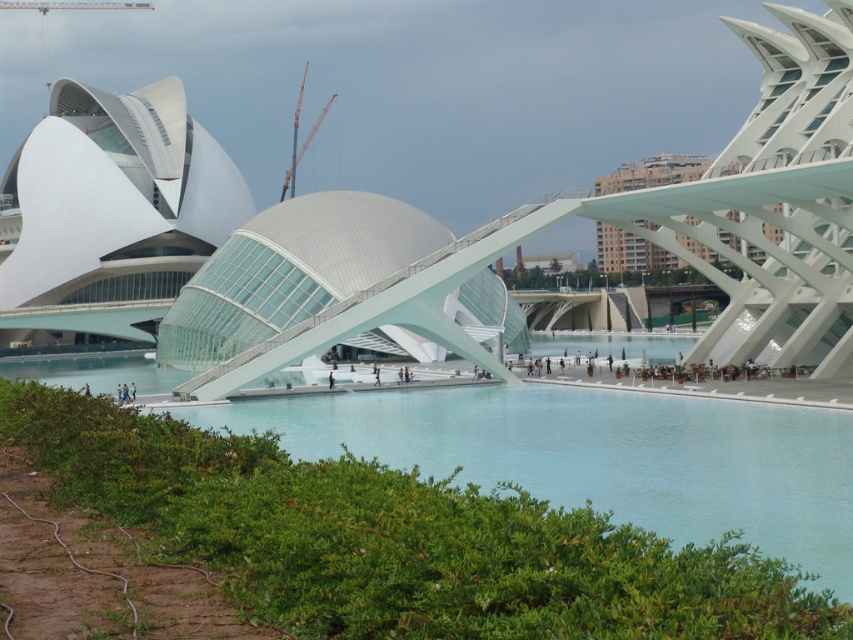
Is clear blue water at center thinner than orange metallic crane at center?

No.

Between clear blue water at center and orange metallic crane at center, which one appears on the left side from the viewer's perspective?

orange metallic crane at center is more to the left.

Does point (552, 394) come closer to viewer compared to point (302, 90)?

Yes, point (552, 394) is in front of point (302, 90).

I want to click on clear blue water at center, so (561, 448).

Does clear blue water at center have a greater width compared to white glass dome at center?

In fact, clear blue water at center might be narrower than white glass dome at center.

Is clear blue water at center smaller than white glass dome at center?

Yes.

Is point (762, 493) positioned before point (811, 296)?

Yes, it is in front of point (811, 296).

At what (x,y) coordinates should I click in order to perform the action: click on clear blue water at center. Please return your answer as a coordinate pair (x, y). The image size is (853, 640). Looking at the image, I should click on (561, 448).

Can you confirm if white glass dome at center is smaller than orange metallic crane at center?

Incorrect, white glass dome at center is not smaller in size than orange metallic crane at center.

Is point (608, 205) more distant than point (300, 80)?

No, (608, 205) is closer to viewer.

Identify the location of white glass dome at center. Image resolution: width=853 pixels, height=640 pixels. (793, 96).